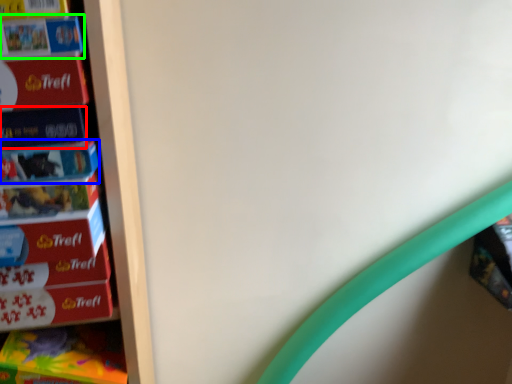
Question: Considering the real-world distances, which object is farthest from paperback book (highlighted by a red box)? paperback book (highlighted by a blue box) or book (highlighted by a green box)?

Choices:
 (A) paperback book
 (B) book

Answer: (B)